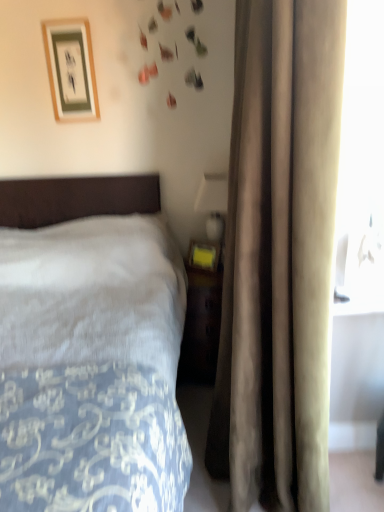
Question: Does white soft bed at left turn towards matte gold picture frame at upper left?

Choices:
 (A) no
 (B) yes

Answer: (A)

Question: Is white soft bed at left smaller than matte gold picture frame at upper left?

Choices:
 (A) no
 (B) yes

Answer: (A)

Question: Is white soft bed at left positioned with its back to matte gold picture frame at upper left?

Choices:
 (A) no
 (B) yes

Answer: (A)

Question: From the image's perspective, is white soft bed at left located above matte gold picture frame at upper left?

Choices:
 (A) yes
 (B) no

Answer: (B)

Question: Is white soft bed at left surrounding matte gold picture frame at upper left?

Choices:
 (A) no
 (B) yes

Answer: (A)

Question: Is matte yellow plastic at right spatially inside beige velvet curtain at right, or outside of it?

Choices:
 (A) outside
 (B) inside

Answer: (B)

Question: From a real-world perspective, relative to beige velvet curtain at right, is matte yellow plastic at right vertically above or below?

Choices:
 (A) above
 (B) below

Answer: (B)

Question: Is matte yellow plastic at right in front of or behind beige velvet curtain at right in the image?

Choices:
 (A) behind
 (B) front

Answer: (A)

Question: Considering the positions of matte yellow plastic at right and beige velvet curtain at right in the image, is matte yellow plastic at right wider or thinner than beige velvet curtain at right?

Choices:
 (A) wide
 (B) thin

Answer: (B)

Question: From a real-world perspective, is beige velvet curtain at right physically located above or below white soft bed at left?

Choices:
 (A) above
 (B) below

Answer: (A)

Question: Would you say beige velvet curtain at right is to the left or to the right of white soft bed at left in the picture?

Choices:
 (A) right
 (B) left

Answer: (A)

Question: In terms of size, does beige velvet curtain at right appear bigger or smaller than white soft bed at left?

Choices:
 (A) big
 (B) small

Answer: (B)

Question: Relative to white soft bed at left, is beige velvet curtain at right in front or behind?

Choices:
 (A) behind
 (B) front

Answer: (A)

Question: In terms of height, does beige velvet curtain at right look taller or shorter compared to matte gold picture frame at upper left?

Choices:
 (A) short
 (B) tall

Answer: (B)

Question: From a real-world perspective, relative to matte gold picture frame at upper left, is beige velvet curtain at right vertically above or below?

Choices:
 (A) above
 (B) below

Answer: (B)